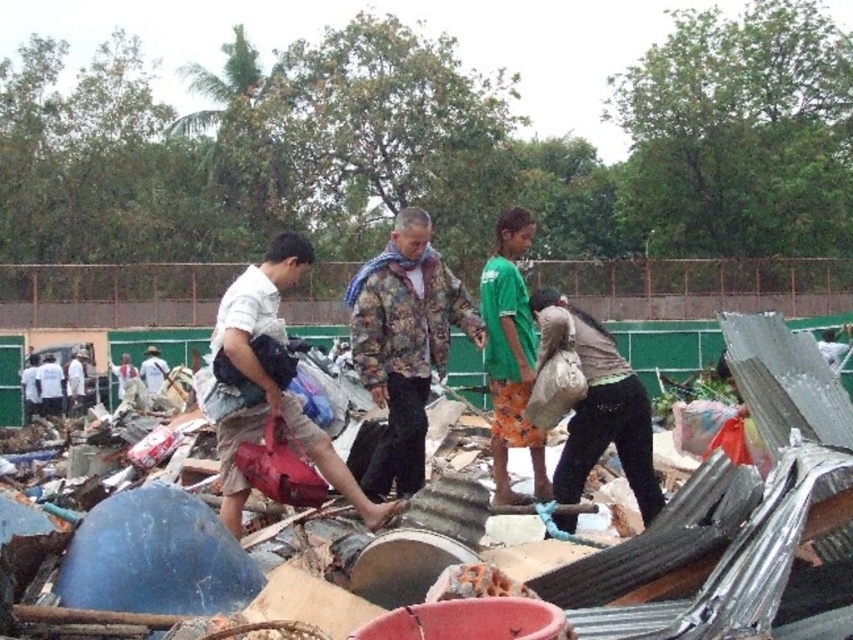
You are a safety inspector at the cleanup site. You notice the rusty metal debris at center and the light brown fabric shirt at left. According to safety regulations, the minimum safe distance between workers and hazardous materials like rusty metal debris should be 50 feet. Is the current distance compliant with the regulation?

The distance between the rusty metal debris at center and the light brown fabric shirt at left is 70.26 feet, which exceeds the required 50 feet minimum safe distance. Therefore, the current setup complies with the safety regulations.

You are standing at the origin of the coordinate system in the scene. There is a point at coordinate point (404,342). What object is located at that point?

The point at coordinate (404,342) corresponds to the floral patterned jacket at center.

You are part of the cleanup crew and need to hand a tool to the person wearing the light brown fabric shirt at left. The tool is currently on the brown fabric bag at center. Can you reach them directly without moving the bag?

The light brown fabric shirt at left is closer to the viewer than the brown fabric bag at center, so you can reach them directly without moving the bag.